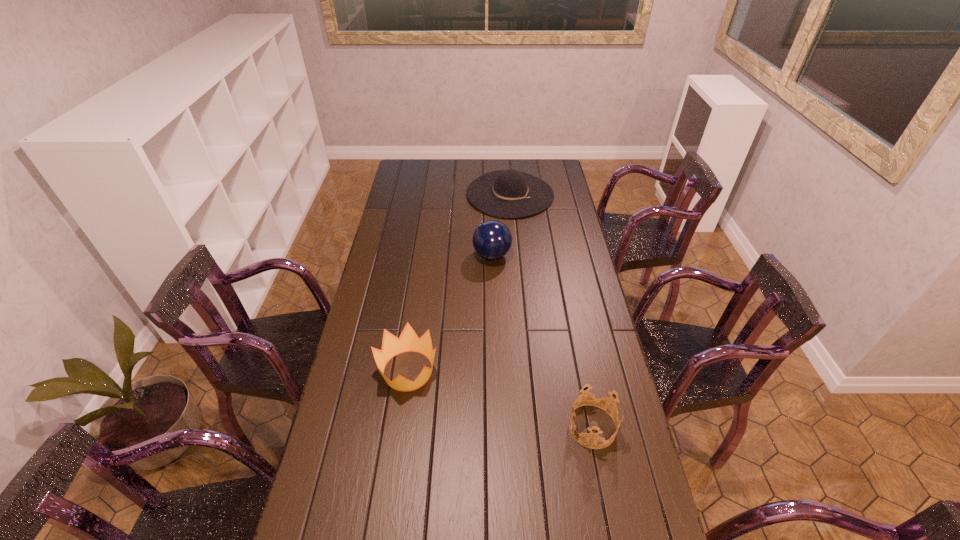
Locate an element on the screen. The width and height of the screenshot is (960, 540). free spot that satisfies the following two spatial constraints: 1. on the front-facing side of the farthest object; 2. on the surface of the tallest object near the finger holes is located at coordinates (516, 255).

This screenshot has height=540, width=960. I want to click on vacant point that satisfies the following two spatial constraints: 1. on the surface of the tallest object near the finger holes; 2. on the left side of the right crown, so click(497, 427).

Image resolution: width=960 pixels, height=540 pixels. Find the location of `free space that satisfies the following two spatial constraints: 1. on the front-facing side of the nearest object; 2. on the left side of the sombrero`. free space that satisfies the following two spatial constraints: 1. on the front-facing side of the nearest object; 2. on the left side of the sombrero is located at coordinates click(x=531, y=427).